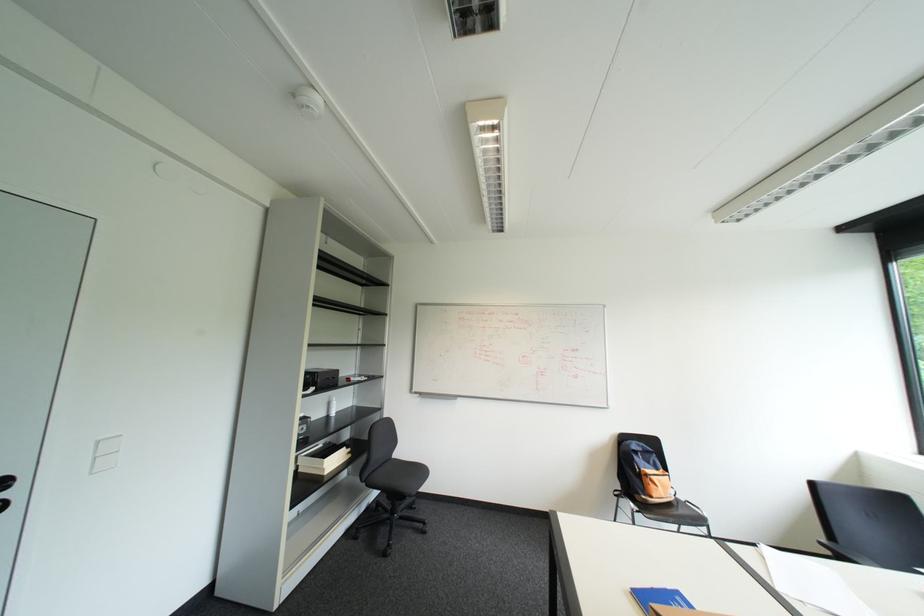
Where would you sit the black chair sitting surface? Please return your answer as a coordinate pair (x, y).

(406, 474)